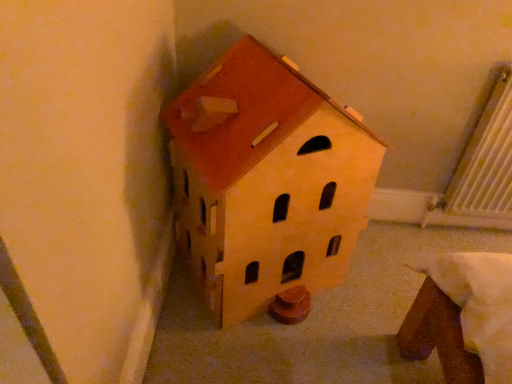
Image resolution: width=512 pixels, height=384 pixels. What do you see at coordinates (267, 181) in the screenshot?
I see `matte wood house at center` at bounding box center [267, 181].

Find the location of a particular element. Image resolution: width=512 pixels, height=384 pixels. matte wood house at center is located at coordinates (267, 181).

Identify the location of matte wood house at center. This screenshot has width=512, height=384. (267, 181).